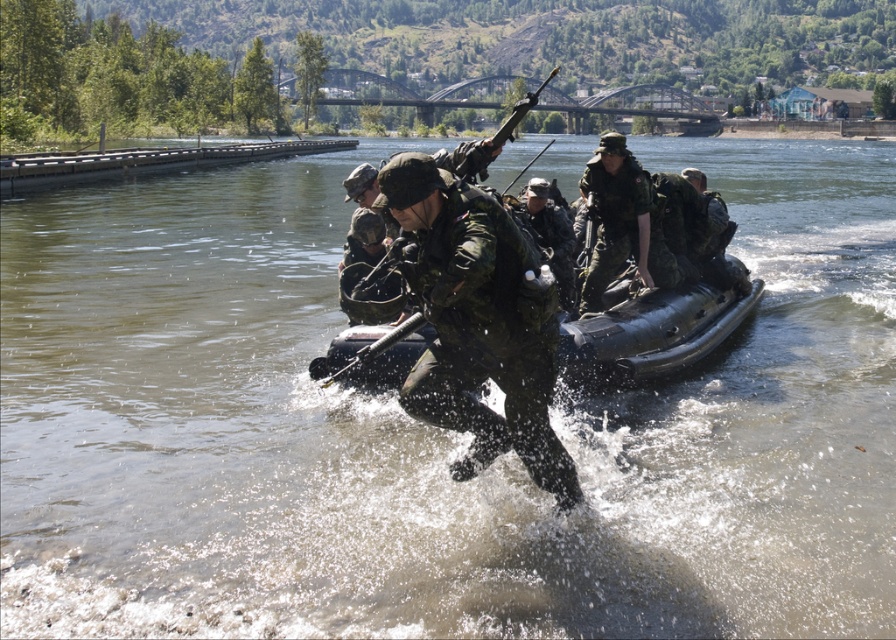
Question: Which point is closer to the camera taking this photo?

Choices:
 (A) (501, 212)
 (B) (377, 364)
 (C) (543, 237)
 (D) (616, 193)

Answer: (A)

Question: Is camouflage fabric soldier at center smaller than black rubber boat at center?

Choices:
 (A) yes
 (B) no

Answer: (A)

Question: Is camouflage fabric soldier at center bigger than matte green uniform at center?

Choices:
 (A) yes
 (B) no

Answer: (B)

Question: Which point is farther from the camera taking this photo?

Choices:
 (A) (562, 220)
 (B) (385, 365)
 (C) (612, 273)

Answer: (A)

Question: Which of these objects is positioned closest to the matte green uniform at center?

Choices:
 (A) camouflage fabric soldier at center
 (B) green matte uniform at center

Answer: (B)

Question: Is camouflage fabric soldier at center smaller than green matte uniform at center?

Choices:
 (A) no
 (B) yes

Answer: (A)